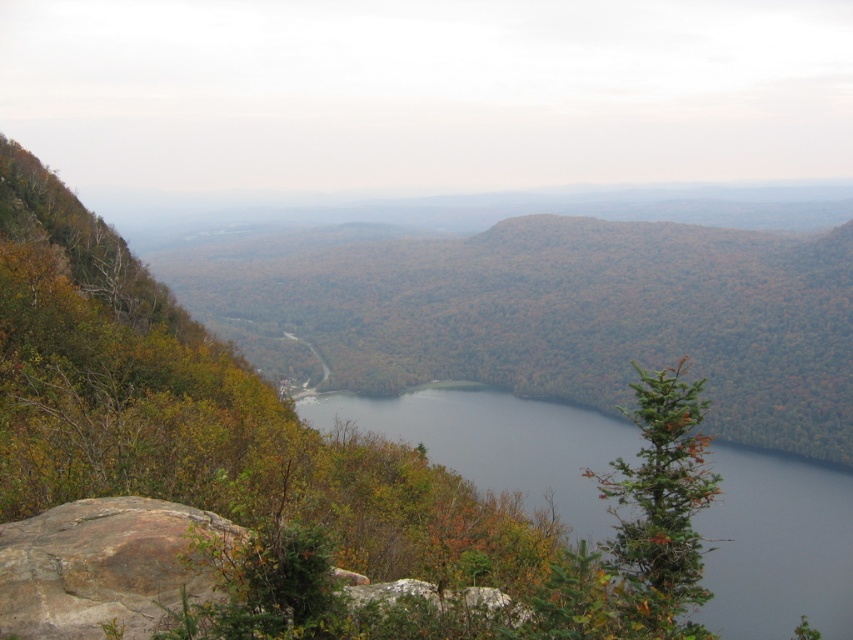
Is the position of dark blue water at center less distant than that of brown rough rock at lower left?

No, dark blue water at center is behind brown rough rock at lower left.

Which is more to the right, dark blue water at center or brown rough rock at lower left?

dark blue water at center is more to the right.

Image resolution: width=853 pixels, height=640 pixels. What do you see at coordinates (776, 545) in the screenshot? I see `dark blue water at center` at bounding box center [776, 545].

Locate an element on the screen. The height and width of the screenshot is (640, 853). dark blue water at center is located at coordinates [776, 545].